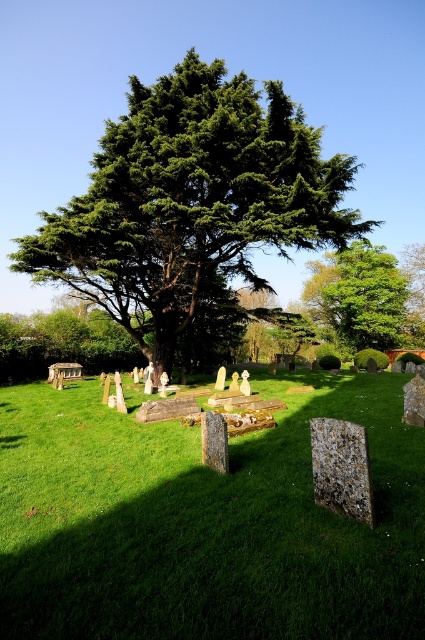
You are standing in the cemetery and want to walk from point A to point B. Point A is at coordinate point A which is point (331, 296) and point B is at point (354, 516). Which point is closer to you when you start walking?

Point A at point (331, 296) is closer to you because it is further to the camera than point B at point (354, 516), meaning it is nearer in your line of sight.

You are standing at the entrance of the cemetery and see two points marked on the ground. The first point is at coordinate point (255, 634) and the second is at point (376, 344). Which point do you think is closer to you?

Point (255, 634) is closer to the viewer than point (376, 344).

You are standing in a cemetery and want to place a new 2.5 meter wide flower bed between you and the green stone gravestones at center. Is there enough space?

The distance between you and the green stone gravestones at center is 3.14 meters. Since the flower bed is 2.5 meters wide, there is enough space to place it between you and the gravestones.